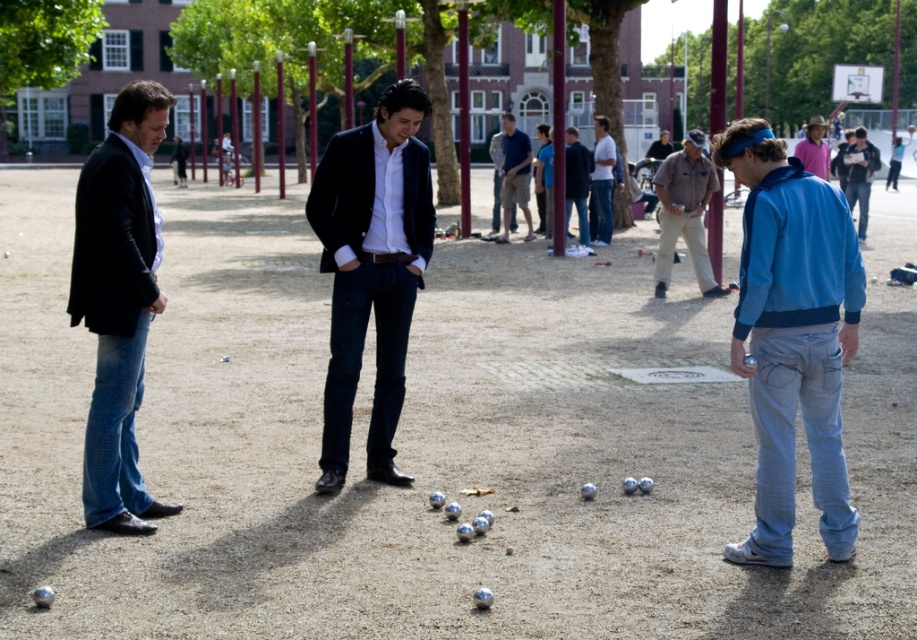
Question: Is khaki cotton pants at center above dark blue shirt at center?

Choices:
 (A) no
 (B) yes

Answer: (A)

Question: Can you confirm if matte black blazer at left is thinner than dark blue shirt at center?

Choices:
 (A) no
 (B) yes

Answer: (A)

Question: Is khaki cotton pants at center to the right of dark blue shirt at center from the viewer's perspective?

Choices:
 (A) no
 (B) yes

Answer: (B)

Question: Which point is closer to the camera taking this photo?

Choices:
 (A) (x=113, y=122)
 (B) (x=382, y=432)
 (C) (x=593, y=184)

Answer: (A)

Question: Which object appears closest to the camera in this image?

Choices:
 (A) white shirt at center
 (B) matte black suit at center
 (C) dark blue jeans at center

Answer: (B)

Question: Which point is closer to the camera?

Choices:
 (A) (322, 460)
 (B) (787, 481)
 (C) (112, 323)
 (D) (506, 157)

Answer: (B)